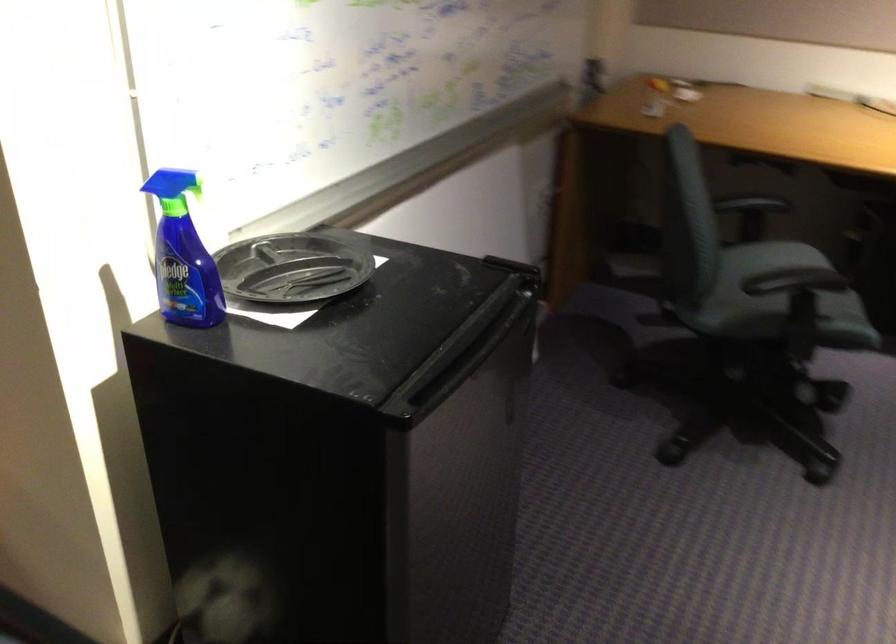
Find the location of `chair sitting surface`. chair sitting surface is located at coordinates (771, 292).